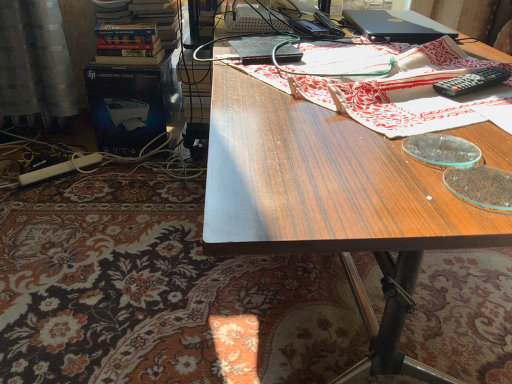
What do you see at coordinates (35, 62) in the screenshot? I see `satin curtain at left` at bounding box center [35, 62].

The width and height of the screenshot is (512, 384). In order to click on satin curtain at left in this screenshot , I will do `click(35, 62)`.

I want to click on wooden desk at center, so 332,203.

From a real-world perspective, which is physically below, hardcover books at upper left or wooden table at center?

hardcover books at upper left is physically lower.

Is hardcover books at upper left oriented towards wooden table at center?

No, hardcover books at upper left is not oriented towards wooden table at center.

Considering the relative sizes of hardcover books at upper left and wooden table at center in the image provided, is hardcover books at upper left bigger than wooden table at center?

Yes, hardcover books at upper left is bigger than wooden table at center.

From the image's perspective, is hardcover books at upper left positioned above or below black matte laptop at upper right?

Clearly, from the image's perspective, hardcover books at upper left is above black matte laptop at upper right.

Considering the sizes of objects hardcover books at upper left and black matte laptop at upper right in the image provided, who is bigger, hardcover books at upper left or black matte laptop at upper right?

Bigger between the two is hardcover books at upper left.

Between hardcover books at upper left and black matte laptop at upper right, which one has more height?

With more height is hardcover books at upper left.

Is hardcover books at upper left situated inside black matte laptop at upper right or outside?

hardcover books at upper left lies outside black matte laptop at upper right.

From the picture: Who is shorter, black plastic remote control at upper right or hardcover books at upper left?

black plastic remote control at upper right is shorter.

From a real-world perspective, who is located higher, black plastic remote control at upper right or hardcover books at upper left?

From a 3D spatial view, black plastic remote control at upper right is above.

Would you say black plastic remote control at upper right is inside or outside hardcover books at upper left?

black plastic remote control at upper right is not enclosed by hardcover books at upper left.

Can you see black plastic remote control at upper right touching hardcover books at upper left?

No, black plastic remote control at upper right is not beside hardcover books at upper left.

Identify the location of remote control lying behind the wooden table at center. This screenshot has height=384, width=512. (472, 82).

Which of these two, black plastic remote control at upper right or wooden table at center, stands shorter?

With less height is black plastic remote control at upper right.

Does black plastic remote control at upper right have a lesser width compared to wooden table at center?

Indeed, black plastic remote control at upper right has a lesser width compared to wooden table at center.

Is black plastic remote control at upper right completely or partially outside of wooden table at center?

No, black plastic remote control at upper right is not entirely external to wooden table at center.

Is black matte laptop at upper right closer to the viewer compared to hardcover books at upper left?

That is True.

From their relative heights in the image, would you say black matte laptop at upper right is taller or shorter than hardcover books at upper left?

black matte laptop at upper right is shorter than hardcover books at upper left.

Does black matte laptop at upper right have a larger size compared to hardcover books at upper left?

No.

Between wooden table at center and wooden desk at center, which one has smaller width?

wooden table at center is thinner.

From the image's perspective, is wooden table at center on wooden desk at center?

Yes, from the image's perspective, wooden table at center is over wooden desk at center.

Does point (382, 62) come in front of point (392, 185)?

No, it is behind (392, 185).

From a real-world perspective, who is located higher, wooden table at center or wooden desk at center?

wooden table at center, from a real-world perspective.

From the image's perspective, is wooden table at center below black matte laptop at upper right?

Yes, from the image's perspective, wooden table at center is beneath black matte laptop at upper right.

From the picture: Is wooden table at center not close to black matte laptop at upper right?

They are positioned close to each other.

From a real-world perspective, is wooden table at center over black matte laptop at upper right?

No.

Image resolution: width=512 pixels, height=384 pixels. I want to click on cloth below the hardcover books at upper left (from the image's perspective), so click(388, 85).

Locate an element on the screen. The height and width of the screenshot is (384, 512). book lying on the left of black matte laptop at upper right is located at coordinates (140, 35).

Considering their positions, is wooden table at center positioned closer to wooden desk at center than hardcover books at upper left?

Among the two, wooden table at center is located nearer to wooden desk at center.

Looking at the image, which one is located further to wooden table at center, satin curtain at left or black plastic remote control at upper right?

black plastic remote control at upper right is further to wooden table at center.

When comparing their distances from wooden desk at center, does black plastic remote control at upper right or wooden table at center seem closer?

wooden table at center is positioned closer to the anchor wooden desk at center.

From the image, which object appears to be farther from satin curtain at left, black plastic remote control at upper right or black matte laptop at upper right?

The object further to satin curtain at left is black plastic remote control at upper right.

Looking at the image, which one is located further to wooden table at center, black matte laptop at upper right or hardcover books at upper left?

black matte laptop at upper right.

From the image, which object appears to be nearer to hardcover books at upper left, black plastic remote control at upper right or wooden table at center?

wooden table at center.

Looking at the image, which one is located further to wooden table at center, wooden table at center or satin curtain at left?

satin curtain at left lies further to wooden table at center than the other object.

Which object lies further to the anchor point satin curtain at left, wooden table at center or wooden table at center?

Among the two, wooden table at center is located further to satin curtain at left.

I want to click on cloth located between wooden desk at center and black matte laptop at upper right in the depth direction, so click(x=388, y=85).

Where is `book situated between satin curtain at left and wooden table at center from left to right`? This screenshot has width=512, height=384. book situated between satin curtain at left and wooden table at center from left to right is located at coordinates (140, 35).

The height and width of the screenshot is (384, 512). Find the location of `curtain between wooden desk at center and hardcover books at upper left in the front-back direction`. curtain between wooden desk at center and hardcover books at upper left in the front-back direction is located at coordinates (35, 62).

Find the location of a particular element. The width and height of the screenshot is (512, 384). cloth between hardcover books at upper left and black matte laptop at upper right is located at coordinates (388, 85).